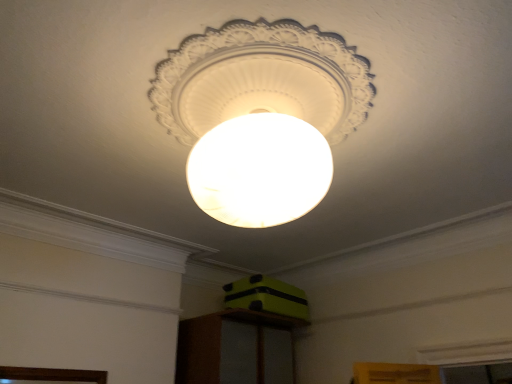
Find the location of a particular element. This screenshot has height=384, width=512. white matte lampshade at center is located at coordinates (261, 116).

What do you see at coordinates (261, 116) in the screenshot? The height and width of the screenshot is (384, 512). I see `white matte lampshade at center` at bounding box center [261, 116].

Where is `white matte lampshade at center`? white matte lampshade at center is located at coordinates (261, 116).